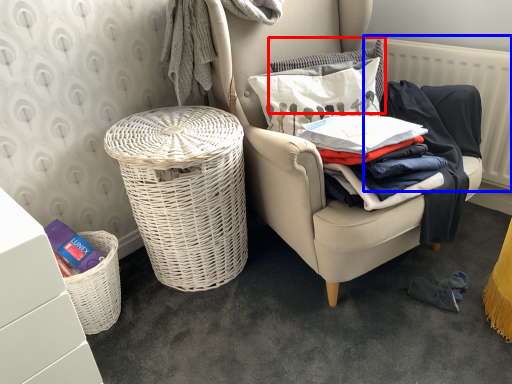
Question: Which object is closer to the camera taking this photo, pillow (highlighted by a red box) or radiator (highlighted by a blue box)?

Choices:
 (A) pillow
 (B) radiator

Answer: (B)